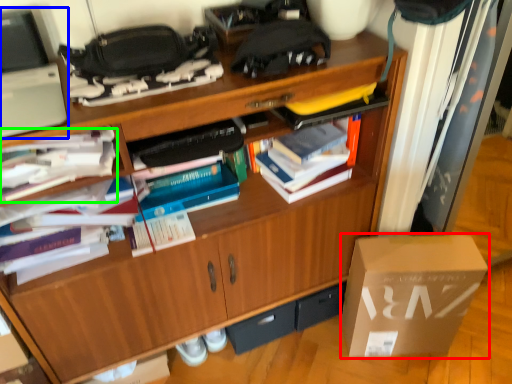
Question: Based on their relative distances, which object is farther from box (highlighted by a red box)? Choose from computer (highlighted by a blue box) and book (highlighted by a green box).

Choices:
 (A) computer
 (B) book

Answer: (A)